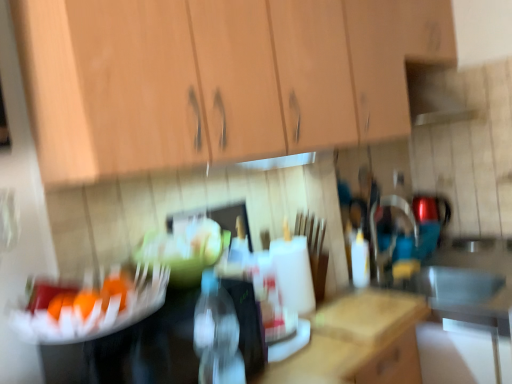
What do you see at coordinates (115, 290) in the screenshot? I see `orange matte fruit at center` at bounding box center [115, 290].

What do you see at coordinates (217, 334) in the screenshot? I see `transparent plastic bottle at center, the second bottle positioned from the back` at bounding box center [217, 334].

Measure the distance between white plastic bottle at center, the first bottle when ordered from right to left, and camera.

The depth of white plastic bottle at center, the first bottle when ordered from right to left, is 5.60 feet.

Where is `orange matte fruit at center`? This screenshot has height=384, width=512. orange matte fruit at center is located at coordinates (115, 290).

Is point (240, 378) in front of point (362, 246)?

That is True.

Considering the positions of objects transparent plastic bottle at center, positioned as the first bottle in left-to-right order, and white plastic bottle at center, arranged as the 2th bottle when viewed from the left, in the image provided, who is more to the right, transparent plastic bottle at center, positioned as the first bottle in left-to-right order, or white plastic bottle at center, arranged as the 2th bottle when viewed from the left,?

From the viewer's perspective, white plastic bottle at center, arranged as the 2th bottle when viewed from the left, appears more on the right side.

Find the location of a particular element. bottle that is behind the transparent plastic bottle at center, the second bottle from the right is located at coordinates (360, 261).

Between transparent plastic bottle at center, which is the 1th bottle in front-to-back order, and white plastic bottle at center, which appears as the first bottle when viewed from the back, which one has less height?

Standing shorter between the two is white plastic bottle at center, which appears as the first bottle when viewed from the back.

Would you say wooden cabinet at upper center is inside or outside white plastic bottle at center, the first bottle when ordered from right to left?

wooden cabinet at upper center is not enclosed by white plastic bottle at center, the first bottle when ordered from right to left.

Is point (63, 76) closer to viewer compared to point (358, 247)?

Yes.

Which of these two, wooden cabinet at upper center or white plastic bottle at center, arranged as the 2th bottle when viewed from the left, stands taller?

wooden cabinet at upper center is taller.

Which object is more forward, wooden cabinet at upper center or white plastic bottle at center, the first bottle when ordered from right to left?

wooden cabinet at upper center is in front.

Considering the relative sizes of white plastic bottle at center, the first bottle when ordered from right to left, and transparent plastic bottle at center, the second bottle positioned from the back, in the image provided, is white plastic bottle at center, the first bottle when ordered from right to left, thinner than transparent plastic bottle at center, the second bottle positioned from the back,?

Yes.

From the image's perspective, does white plastic bottle at center, arranged as the 2th bottle when viewed from the front, appear lower than transparent plastic bottle at center, positioned as the first bottle in left-to-right order?

No, from the image's perspective, white plastic bottle at center, arranged as the 2th bottle when viewed from the front, is not beneath transparent plastic bottle at center, positioned as the first bottle in left-to-right order.

Is white plastic bottle at center, arranged as the 2th bottle when viewed from the left, taller or shorter than transparent plastic bottle at center, the second bottle from the right?

In the image, white plastic bottle at center, arranged as the 2th bottle when viewed from the left, appears to be shorter than transparent plastic bottle at center, the second bottle from the right.

From the image's perspective, which object appears higher, transparent plastic bottle at center, positioned as the first bottle in left-to-right order, or orange matte fruit at center?

orange matte fruit at center is shown above in the image.

How different are the orientations of transparent plastic bottle at center, positioned as the first bottle in left-to-right order, and orange matte fruit at center in degrees?

63.1 degrees separate the facing orientations of transparent plastic bottle at center, positioned as the first bottle in left-to-right order, and orange matte fruit at center.

Is transparent plastic bottle at center, which is the 1th bottle in front-to-back order, looking in the opposite direction of orange matte fruit at center?

No.

Which of these two, transparent plastic bottle at center, which is the 1th bottle in front-to-back order, or orange matte fruit at center, is thinner?

orange matte fruit at center is thinner.

Does orange matte fruit at center have a lesser width compared to white plastic bottle at center, arranged as the 2th bottle when viewed from the left?

Indeed, orange matte fruit at center has a lesser width compared to white plastic bottle at center, arranged as the 2th bottle when viewed from the left.

Can you confirm if orange matte fruit at center is positioned to the left of white plastic bottle at center, arranged as the 2th bottle when viewed from the left?

Yes, orange matte fruit at center is to the left of white plastic bottle at center, arranged as the 2th bottle when viewed from the left.

This screenshot has width=512, height=384. There is a orange matte fruit at center. Find the location of `the 1st bottle below it (from the image's perspective)`. the 1st bottle below it (from the image's perspective) is located at coordinates (360, 261).

Based on their positions, is transparent plastic bottle at center, positioned as the first bottle in left-to-right order, located to the left or right of wooden cabinet at upper center?

transparent plastic bottle at center, positioned as the first bottle in left-to-right order, is to the left of wooden cabinet at upper center.

How many degrees apart are the facing directions of transparent plastic bottle at center, the second bottle positioned from the back, and wooden cabinet at upper center?

The angular difference between transparent plastic bottle at center, the second bottle positioned from the back, and wooden cabinet at upper center is 90.1 degrees.

How distant is transparent plastic bottle at center, which is the 1th bottle in front-to-back order, from wooden cabinet at upper center?

transparent plastic bottle at center, which is the 1th bottle in front-to-back order, is 24.01 inches away from wooden cabinet at upper center.

Who is taller, transparent plastic bottle at center, which is the 1th bottle in front-to-back order, or wooden cabinet at upper center?

wooden cabinet at upper center.

Is orange matte fruit at center positioned before wooden cabinet at upper center?

No, orange matte fruit at center is further to the viewer.

Can you confirm if orange matte fruit at center is wider than wooden cabinet at upper center?

No, orange matte fruit at center is not wider than wooden cabinet at upper center.

Is the surface of orange matte fruit at center in direct contact with wooden cabinet at upper center?

No, orange matte fruit at center is not in contact with wooden cabinet at upper center.

The width and height of the screenshot is (512, 384). I want to click on bottle located behind the transparent plastic bottle at center, which is the 1th bottle in front-to-back order, so click(360, 261).

At what (x,y) coordinates should I click in order to perform the action: click on bottle that is the 2nd one below the wooden cabinet at upper center (from a real-world perspective). Please return your answer as a coordinate pair (x, y). This screenshot has width=512, height=384. Looking at the image, I should click on (360, 261).

Estimate the real-world distances between objects in this image. Which object is closer to wooden cabinet at upper center, orange matte fruit at center or white plastic bottle at center, the first bottle when ordered from right to left?

orange matte fruit at center is positioned closer to the anchor wooden cabinet at upper center.

When comparing their distances from transparent plastic bottle at center, positioned as the first bottle in left-to-right order, does white plastic bottle at center, arranged as the 2th bottle when viewed from the front, or orange matte fruit at center seem closer?

orange matte fruit at center is positioned closer to the anchor transparent plastic bottle at center, positioned as the first bottle in left-to-right order.

When comparing their distances from transparent plastic bottle at center, which is the 1th bottle in front-to-back order, does orange matte fruit at center or wooden cabinet at upper center seem closer?

orange matte fruit at center is positioned closer to the anchor transparent plastic bottle at center, which is the 1th bottle in front-to-back order.

Looking at the image, which one is located further to white plastic bottle at center, the first bottle when ordered from right to left, orange matte fruit at center or transparent plastic bottle at center, the second bottle from the right?

orange matte fruit at center is further to white plastic bottle at center, the first bottle when ordered from right to left.

Based on the photo, based on their spatial positions, is white plastic bottle at center, arranged as the 2th bottle when viewed from the left, or transparent plastic bottle at center, positioned as the first bottle in left-to-right order, further from wooden cabinet at upper center?

white plastic bottle at center, arranged as the 2th bottle when viewed from the left, is further to wooden cabinet at upper center.

Estimate the real-world distances between objects in this image. Which object is closer to orange matte fruit at center, transparent plastic bottle at center, which is the 1th bottle in front-to-back order, or wooden cabinet at upper center?

transparent plastic bottle at center, which is the 1th bottle in front-to-back order, is closer to orange matte fruit at center.

Looking at the image, which one is located closer to orange matte fruit at center, white plastic bottle at center, the first bottle when ordered from right to left, or transparent plastic bottle at center, the second bottle positioned from the back?

transparent plastic bottle at center, the second bottle positioned from the back, lies closer to orange matte fruit at center than the other object.

Which object lies further to the anchor point wooden cabinet at upper center, orange matte fruit at center or transparent plastic bottle at center, the second bottle from the right?

orange matte fruit at center lies further to wooden cabinet at upper center than the other object.

Find the location of `bottle positioned between wooden cabinet at upper center and white plastic bottle at center, arranged as the 2th bottle when viewed from the left, from near to far`. bottle positioned between wooden cabinet at upper center and white plastic bottle at center, arranged as the 2th bottle when viewed from the left, from near to far is located at coordinates (217, 334).

Where is `food between wooden cabinet at upper center and transparent plastic bottle at center, the second bottle from the right, in the up-down direction`? The image size is (512, 384). food between wooden cabinet at upper center and transparent plastic bottle at center, the second bottle from the right, in the up-down direction is located at coordinates (115, 290).

Image resolution: width=512 pixels, height=384 pixels. What are the coordinates of `food between wooden cabinet at upper center and white plastic bottle at center, arranged as the 2th bottle when viewed from the front, along the z-axis` in the screenshot? It's located at (115, 290).

Locate an element on the screen. food between transparent plastic bottle at center, the second bottle positioned from the back, and white plastic bottle at center, arranged as the 2th bottle when viewed from the left, in the front-back direction is located at coordinates (115, 290).